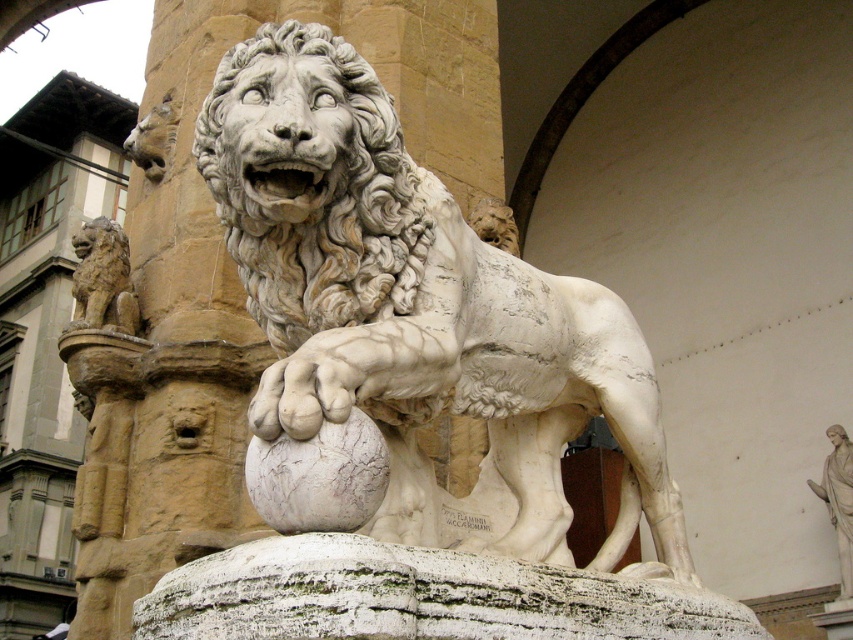
You are an architect assessing the spatial compatibility of two elements in a historical courtyard. The scene includes a white marble pillar at center and a matte stone lion at left. Which element is taller?

The white marble pillar at center is taller than the matte stone lion at left.

You are an art conservator examining the marble sculpture from a distance. You notice two points on the sculpture marked at coordinates point (x=456, y=451) and point (x=115, y=262). Which point is nearer to your viewpoint?

Point (x=456, y=451) is closer to the camera than point (x=115, y=262).

Consider the image. You are an architect evaluating the space between the white marble pillar at center and the matte stone lion at left. If you want to place a decorative vase between them, will it fit if the vase is 1.2 meters wide?

The white marble pillar at center is wider than the matte stone lion at left. However, the exact distance between them isn